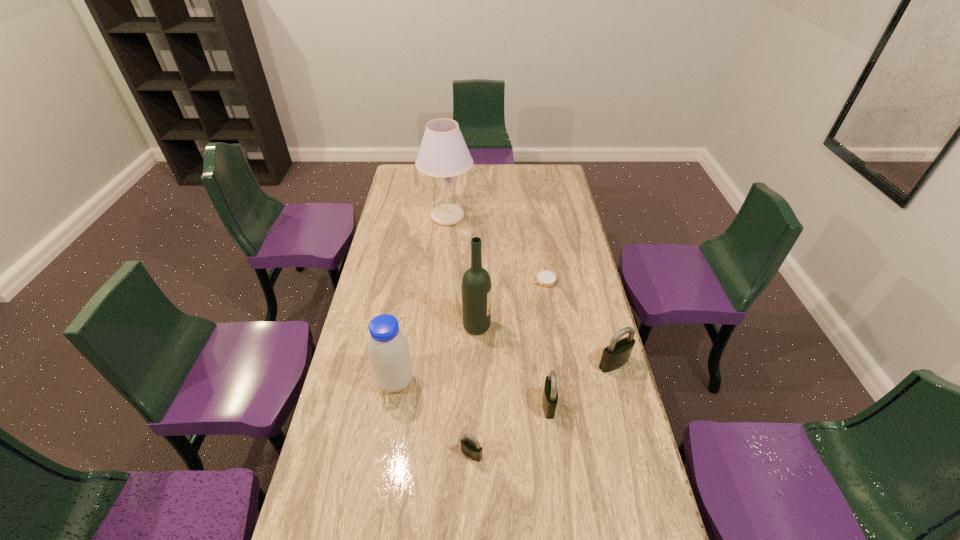
Locate an element on the screen. the leftmost padlock is located at coordinates (471, 448).

Where is `the shortest padlock`? The image size is (960, 540). the shortest padlock is located at coordinates (471, 448).

Locate an element on the screen. the third shortest object is located at coordinates (550, 394).

The height and width of the screenshot is (540, 960). I want to click on the second padlock from right to left, so click(x=550, y=394).

Where is `the farthest padlock`? the farthest padlock is located at coordinates (617, 353).

You are a GUI agent. You are given a task and a screenshot of the screen. Output one action in this format:
    pyautogui.click(x=<x>, y=<y>)
    Task: Click on the rightmost object
    Image resolution: width=960 pixels, height=540 pixels.
    Given the screenshot: What is the action you would take?
    pyautogui.click(x=617, y=353)

Where is `lampshade`? This screenshot has width=960, height=540. lampshade is located at coordinates (443, 152).

You are a GUI agent. You are given a task and a screenshot of the screen. Output one action in this format:
    pyautogui.click(x=<x>, y=<y>)
    Task: Click on the soya milk
    The image size is (960, 540).
    Given the screenshot: What is the action you would take?
    pyautogui.click(x=388, y=348)

Locate an element on the screen. The image size is (960, 540). the third farthest object is located at coordinates (476, 283).

Locate an element on the screen. Image resolution: width=960 pixels, height=540 pixels. compass is located at coordinates (545, 278).